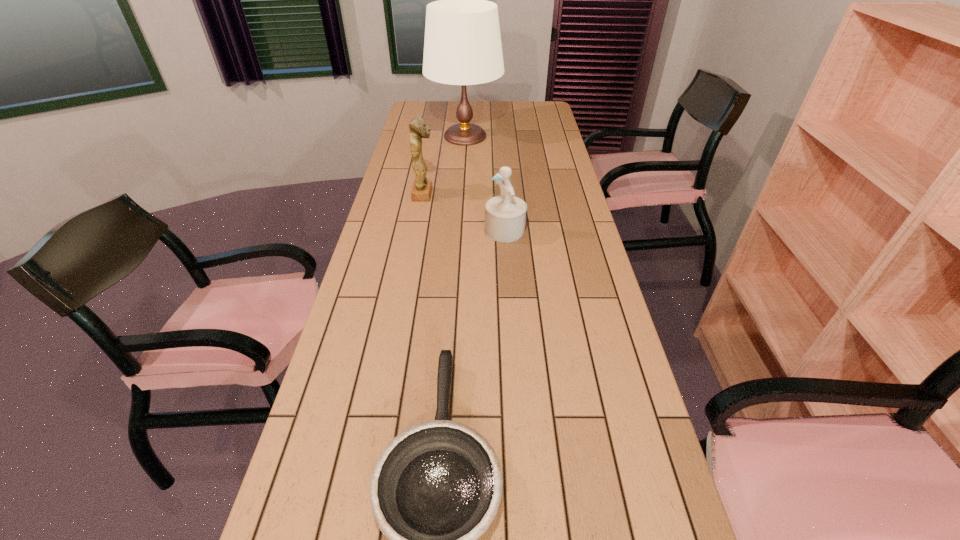
At what (x,y) coordinates should I click in order to perform the action: click on free space between the farthest object and the second farthest object. Please return your answer as a coordinate pair (x, y). Looking at the image, I should click on (444, 165).

This screenshot has height=540, width=960. I want to click on unoccupied position between the shorter figurine and the second farthest object, so click(x=465, y=212).

Locate which object ranks third in proximity to the third tallest object. Please provide its 2D coordinates. Your answer should be formatted as a tuple, i.e. [(x, y)], where the tuple contains the x and y coordinates of a point satisfying the conditions above.

[(462, 46)]

Choose which object is the second nearest neighbor to the tallest object. Please provide its 2D coordinates. Your answer should be formatted as a tuple, i.e. [(x, y)], where the tuple contains the x and y coordinates of a point satisfying the conditions above.

[(505, 215)]